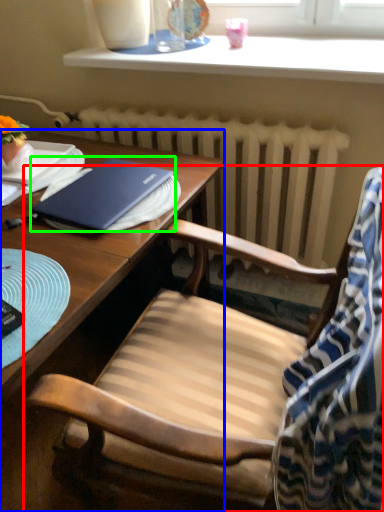
Question: Which object is positioned farthest from chair (highlighted by a red box)? Select from desk (highlighted by a blue box) and notebook (highlighted by a green box).

Choices:
 (A) desk
 (B) notebook

Answer: (A)